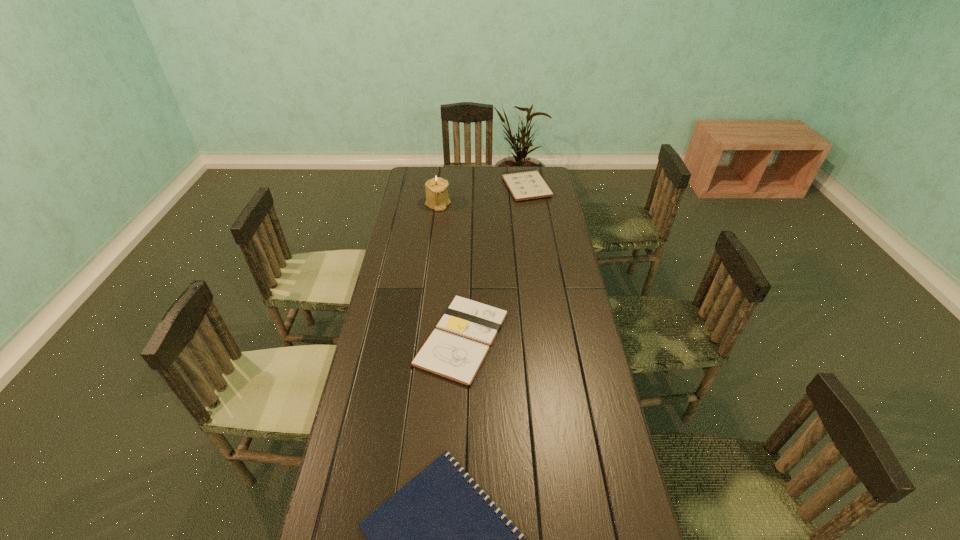
Choose which object is the second nearest neighbor to the candle_holder. Please provide its 2D coordinates. Your answer should be formatted as a tuple, i.e. [(x, y)], where the tuple contains the x and y coordinates of a point satisfying the conditions above.

[(456, 349)]

In order to click on the second closest object to the shortest notepad in this screenshot , I will do `click(437, 198)`.

Point out which notepad is positioned as the second nearest to the third shortest object. Please provide its 2D coordinates. Your answer should be formatted as a tuple, i.e. [(x, y)], where the tuple contains the x and y coordinates of a point satisfying the conditions above.

[(435, 539)]

In order to click on the second closest notepad to the second tallest notepad in this screenshot , I will do `click(527, 185)`.

You are a GUI agent. You are given a task and a screenshot of the screen. Output one action in this format:
    pyautogui.click(x=<x>, y=<y>)
    Task: Click on the free location that satisfies the following two spatial constraints: 1. on the back side of the farthest notepad; 2. on the left side of the candle_holder
    
    Given the screenshot: What is the action you would take?
    pyautogui.click(x=440, y=187)

At what (x,y) coordinates should I click in order to perform the action: click on free location that satisfies the following two spatial constraints: 1. on the front side of the second shortest object; 2. on the left side of the tallest object. Please return your answer as a coordinate pair (x, y). The width and height of the screenshot is (960, 540). Looking at the image, I should click on (420, 339).